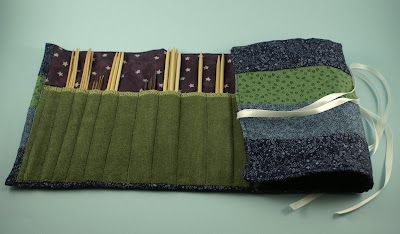
This screenshot has width=400, height=234. In order to click on patterned green fabric in this screenshot , I will do `click(304, 90)`.